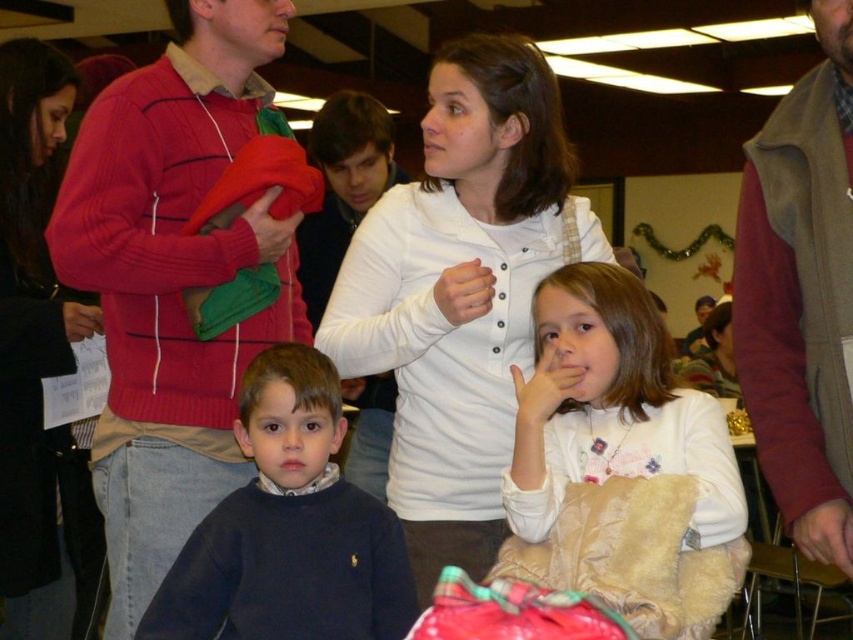
You are a photographer adjusting your camera focus. There are two points in the image that you need to focus on. The first point is at coordinate point (135, 400) and the second is at coordinate point (83, 305). Which point should you focus on first if you want to start with the one closer to the camera?

Point (135, 400) is closer to the camera than point (83, 305), so you should focus on point (135, 400) first.